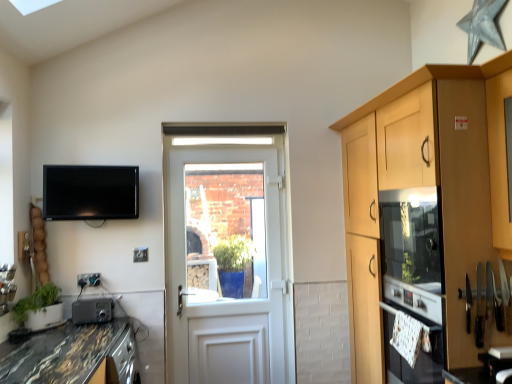
Where is `vacant point above metallic gray radio at lower left (from a real-world perspective)`? vacant point above metallic gray radio at lower left (from a real-world perspective) is located at coordinates (94, 296).